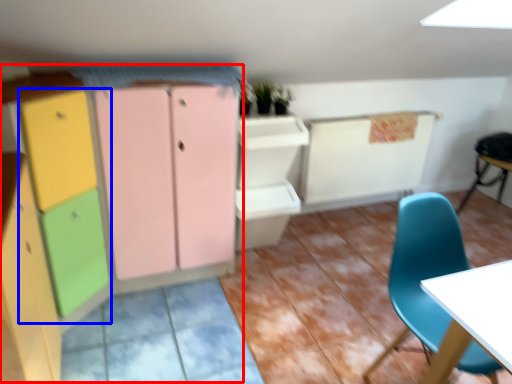
Question: Which object appears farthest to the camera in this image, dresser (highlighted by a red box) or cabinetry (highlighted by a blue box)?

Choices:
 (A) dresser
 (B) cabinetry

Answer: (B)